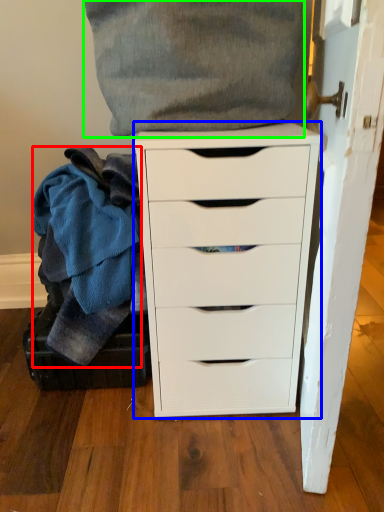
Question: Based on their relative distances, which object is farther from clothing (highlighted by a red box)? Choose from chest of drawers (highlighted by a blue box) and clothing (highlighted by a green box).

Choices:
 (A) chest of drawers
 (B) clothing

Answer: (B)